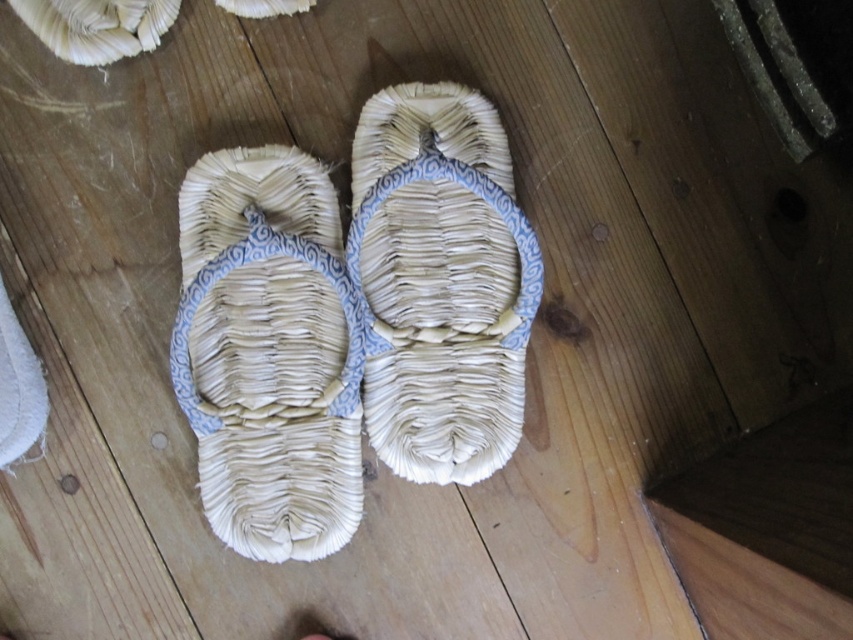
Question: Is woven straw sandal at center closer to camera compared to natural fiber sandal at center?

Choices:
 (A) yes
 (B) no

Answer: (A)

Question: Which point appears farthest from the camera in this image?

Choices:
 (A) (318, 544)
 (B) (408, 364)

Answer: (B)

Question: Can you confirm if woven straw sandal at center is positioned to the left of natural fiber sandal at center?

Choices:
 (A) no
 (B) yes

Answer: (B)

Question: Does woven straw sandal at center come in front of natural fiber sandal at center?

Choices:
 (A) yes
 (B) no

Answer: (A)